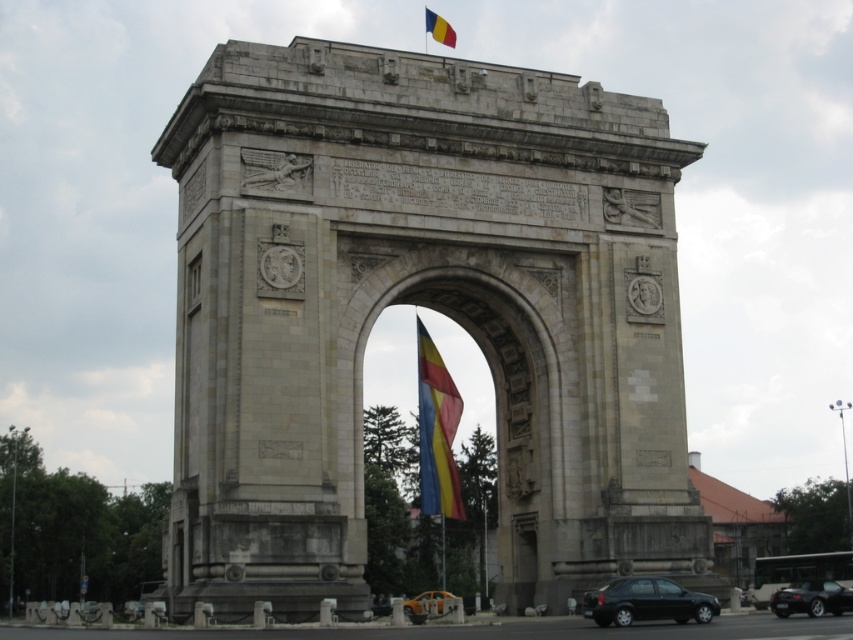
Consider the image. You are standing in front of the grand stone archway and want to take a photo. You notice two points marked on the archway. The first point is at coordinates point (473,214) and the second is at point (790,612). Which point is closer to your camera when taking the photo?

Point point (473,214) is further to the camera than point point (790,612), so the second point is closer to the camera.

You are standing at the center of the grand stone archway. You want to take a photo of the shiny black car at lower right. In which direction should you point your camera?

You should point your camera to the lower right direction to capture the shiny black car at lower right.